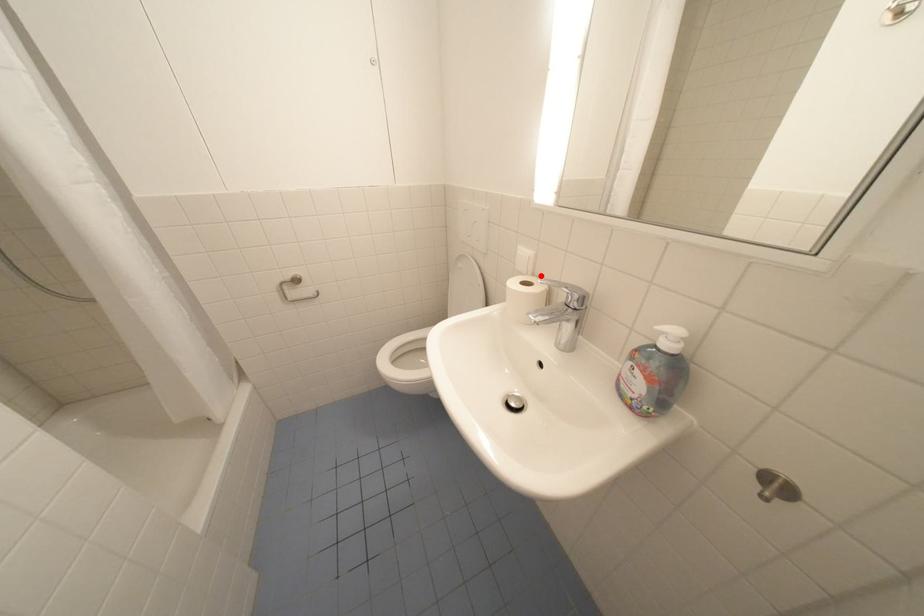
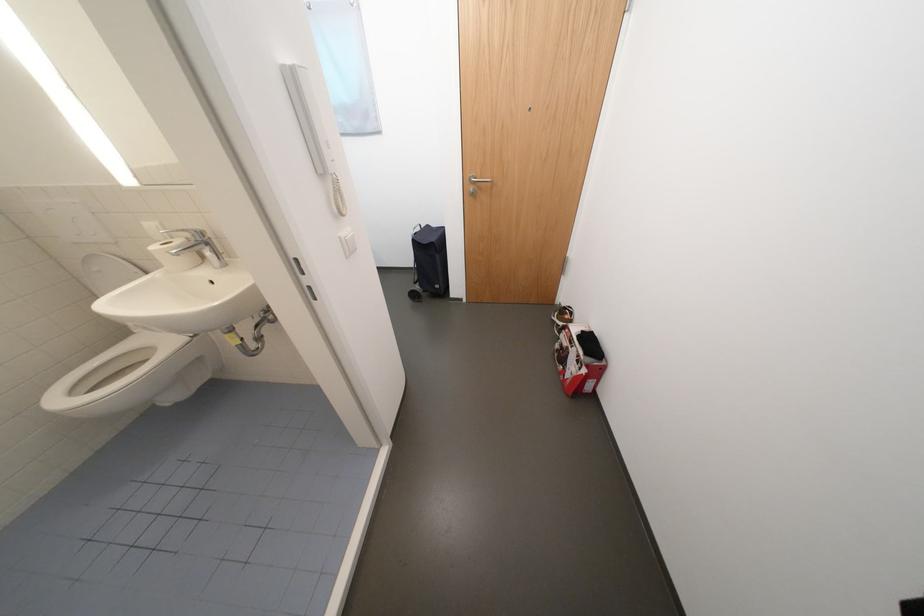
Find the pixel in the second image that matches the highlighted location in the first image.

(179, 238)